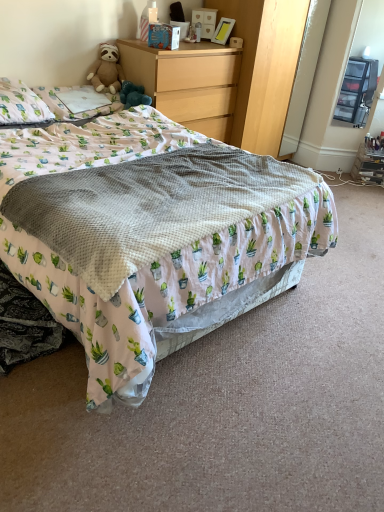
Question: From the image's perspective, is soft brown teddy bear at upper left located above or below wooden dresser at upper center?

Choices:
 (A) below
 (B) above

Answer: (A)

Question: From a real-world perspective, is soft brown teddy bear at upper left above or below wooden dresser at upper center?

Choices:
 (A) below
 (B) above

Answer: (B)

Question: Which object is the farthest from the white printed blanket at center?

Choices:
 (A) soft brown teddy bear at upper left
 (B) wooden dresser at upper center
 (C) white cotton pillow at upper left, the 2th pillow when ordered from left to right
 (D) white fabric pillow at upper left, the 2th pillow when ordered from right to left
 (E) wooden chest of drawers at upper center

Answer: (A)

Question: Which is nearer to the wooden dresser at upper center?

Choices:
 (A) wooden chest of drawers at upper center
 (B) white cotton pillow at upper left, the 2th pillow when ordered from left to right
 (C) soft brown teddy bear at upper left
 (D) white printed blanket at center
 (E) white fabric pillow at upper left, the 2th pillow when ordered from right to left

Answer: (A)